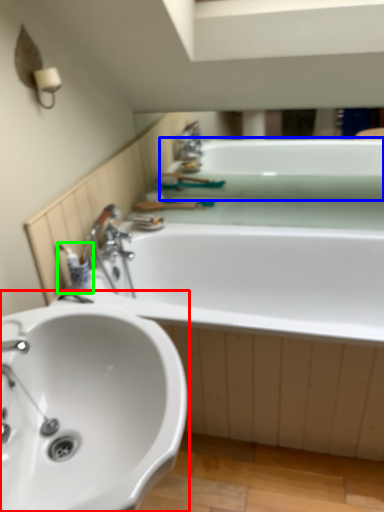
Question: Which object is positioned closest to sink (highlighted by a red box)? Select from bath (highlighted by a blue box) and toiletry (highlighted by a green box).

Choices:
 (A) bath
 (B) toiletry

Answer: (B)